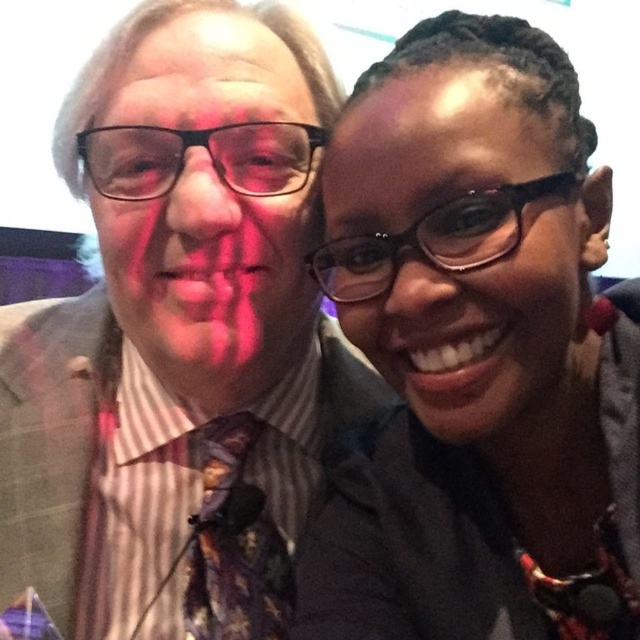
You are standing in front of a photo of two people. You want to touch the point at coordinates point (202, 625). If your hand is 3 inches wide, will your hand cover the point when you touch it?

The point (202, 625) is 25.24 inches away from the viewer. Since your hand is only 3 inches wide, touching it would not cover the point as the distance is much greater than the hand width.

You are a photographer adjusting the camera focus. You need to ensure both the striped fabric shirt at center and the matte black glasses at upper right are in focus. Given their sizes, which object should you adjust the focus towards first?

The striped fabric shirt at center has a greater height compared to matte black glasses at upper right, so you should adjust the focus towards the striped fabric shirt at center first since it is larger and requires more precise focusing.